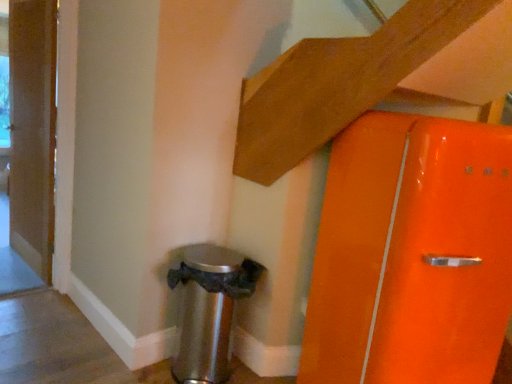
This screenshot has height=384, width=512. I want to click on wooden door at left, so click(32, 130).

Describe the element at coordinates (32, 130) in the screenshot. I see `wooden door at left` at that location.

Identify the location of wooden door at left. Image resolution: width=512 pixels, height=384 pixels. click(32, 130).